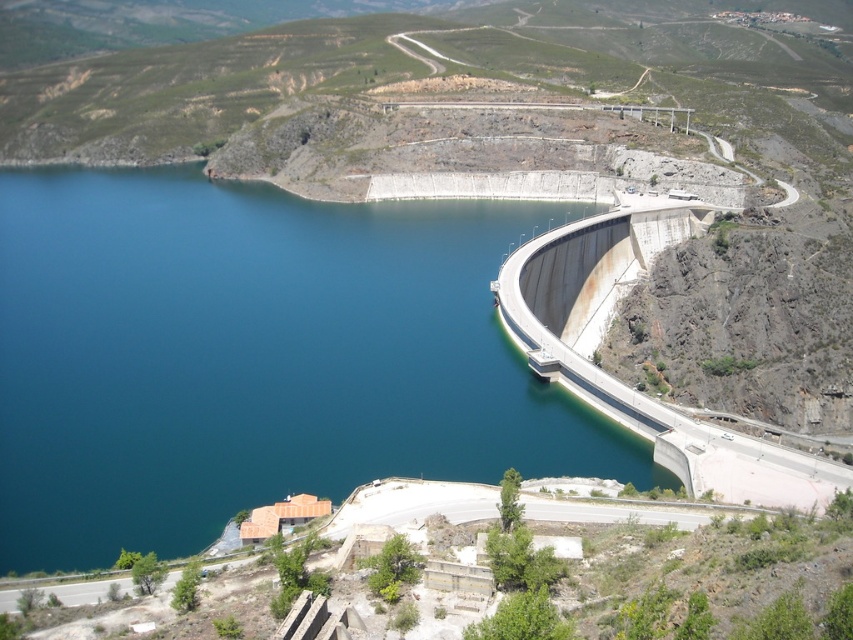
You are a construction inspector tasked with assessing the structural integrity of the dams in the image. Given that the blue concrete dam at center and the concrete dam at right are both part of the same dam system, which one is wider from your observation?

The blue concrete dam at center is wider than the concrete dam at right, as its width surpasses that of the concrete dam at right.

You are a drone operator tasked with capturing aerial footage of the blue concrete dam at center. The drone must maintain a safe altitude of 100 meters above the dam to avoid collision with any nearby structures. Given the dam is located at coordinates point 0.559, 0.299, can you confirm if the drone will be able to fly safely at this altitude without hitting any obstacles?

The blue concrete dam at center is positioned at point (254, 356). Since the drone must maintain a safe altitude of 100 meters above the dam, and there are no other structures mentioned in the scene that could interfere at that height, the drone should be able to fly safely at this altitude without hitting obstacles.